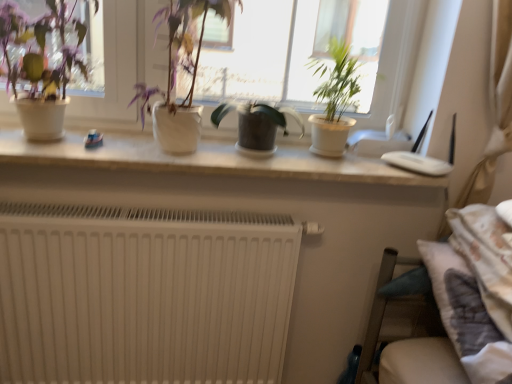
Describe the element at coordinates (256, 124) in the screenshot. I see `green matte plant at center, which is counted as the second houseplant, starting from the right` at that location.

This screenshot has width=512, height=384. I want to click on green matte plant at upper right, positioned as the first houseplant in right-to-left order, so click(x=334, y=100).

Image resolution: width=512 pixels, height=384 pixels. In order to click on matte white pot at upper left, the 1th houseplant from the left in this screenshot , I will do `click(41, 66)`.

The height and width of the screenshot is (384, 512). What do you see at coordinates (41, 66) in the screenshot?
I see `matte white pot at upper left, marked as the 4th houseplant in a right-to-left arrangement` at bounding box center [41, 66].

Locate an element on the screen. Image resolution: width=512 pixels, height=384 pixels. white matte radiator at lower left is located at coordinates (144, 294).

Which is correct: white matte radiator at lower left is inside matte white pot at center, which is counted as the 2th houseplant, starting from the left, or outside of it?

white matte radiator at lower left is outside matte white pot at center, which is counted as the 2th houseplant, starting from the left.

Between white matte radiator at lower left and matte white pot at center, which is counted as the 2th houseplant, starting from the left, which one has larger size?

white matte radiator at lower left.

Which houseplant is the 3rd one when counting from the front of the white matte radiator at lower left? Please provide its 2D coordinates.

[(176, 72)]

Looking at this image, from their relative heights in the image, would you say green matte plant at upper right, positioned as the first houseplant in right-to-left order, is taller or shorter than matte white pot at center, which is counted as the 2th houseplant, starting from the left?

green matte plant at upper right, positioned as the first houseplant in right-to-left order, is shorter than matte white pot at center, which is counted as the 2th houseplant, starting from the left.

Is green matte plant at upper right, positioned as the first houseplant in right-to-left order, bigger than matte white pot at center, which is the third houseplant from right to left?

No, green matte plant at upper right, positioned as the first houseplant in right-to-left order, is not bigger than matte white pot at center, which is the third houseplant from right to left.

Starting from the matte white pot at center, which is counted as the 2th houseplant, starting from the left, which houseplant is the 2nd one behind? Please provide its 2D coordinates.

[(334, 100)]

Identify the location of houseplant located on the left of matte white pot at center, which is counted as the 2th houseplant, starting from the left. (41, 66).

Considering the relative sizes of matte white pot at center, which is the third houseplant from right to left, and matte white pot at upper left, marked as the 4th houseplant in a right-to-left arrangement, in the image provided, is matte white pot at center, which is the third houseplant from right to left, taller than matte white pot at upper left, marked as the 4th houseplant in a right-to-left arrangement,?

Indeed, matte white pot at center, which is the third houseplant from right to left, has a greater height compared to matte white pot at upper left, marked as the 4th houseplant in a right-to-left arrangement.

Considering the relative sizes of matte white pot at center, which is counted as the 2th houseplant, starting from the left, and matte white pot at upper left, the 1th houseplant from the left, in the image provided, is matte white pot at center, which is counted as the 2th houseplant, starting from the left, smaller than matte white pot at upper left, the 1th houseplant from the left,?

Incorrect, matte white pot at center, which is counted as the 2th houseplant, starting from the left, is not smaller in size than matte white pot at upper left, the 1th houseplant from the left.

Can we say matte white pot at center, which is the third houseplant from right to left, lies outside white matte radiator at lower left?

Yes, matte white pot at center, which is the third houseplant from right to left, is located beyond the bounds of white matte radiator at lower left.

Which of these two, matte white pot at center, which is the third houseplant from right to left, or white matte radiator at lower left, is smaller?

With smaller size is matte white pot at center, which is the third houseplant from right to left.

Does matte white pot at center, which is the third houseplant from right to left, lie in front of white matte radiator at lower left?

Yes, it is in front of white matte radiator at lower left.

Is green matte plant at center, which is counted as the second houseplant, starting from the right, oriented towards matte white pot at upper left, the 1th houseplant from the left?

No, green matte plant at center, which is counted as the second houseplant, starting from the right, is not facing towards matte white pot at upper left, the 1th houseplant from the left.

Are green matte plant at center, the 3th houseplant viewed from the left, and matte white pot at upper left, the 1th houseplant from the left, beside each other?

No, green matte plant at center, the 3th houseplant viewed from the left, is not in contact with matte white pot at upper left, the 1th houseplant from the left.

Does green matte plant at center, which is counted as the second houseplant, starting from the right, come behind matte white pot at upper left, marked as the 4th houseplant in a right-to-left arrangement?

Yes, the depth of green matte plant at center, which is counted as the second houseplant, starting from the right, is greater than that of matte white pot at upper left, marked as the 4th houseplant in a right-to-left arrangement.

From the image's perspective, which houseplant is the 3rd one above the green matte plant at center, which is counted as the second houseplant, starting from the right? Please provide its 2D coordinates.

[(41, 66)]

Is point (338, 98) closer or farther from the camera than point (108, 305)?

Point (338, 98) appears to be farther away from the viewer than point (108, 305).

I want to click on radiator that is behind the green matte plant at upper right, positioned as the fourth houseplant in left-to-right order, so click(x=144, y=294).

From a real-world perspective, is green matte plant at upper right, positioned as the fourth houseplant in left-to-right order, physically above white matte radiator at lower left?

Yes, from a real-world perspective, green matte plant at upper right, positioned as the fourth houseplant in left-to-right order, is on top of white matte radiator at lower left.

Which object is positioned more to the left, green matte plant at upper right, positioned as the fourth houseplant in left-to-right order, or white matte radiator at lower left?

white matte radiator at lower left.

Find the location of `houseplant lying behind the white matte radiator at lower left`. houseplant lying behind the white matte radiator at lower left is located at coordinates (256, 124).

Based on the photo, from the image's perspective, is white matte radiator at lower left located above or below green matte plant at center, which is counted as the second houseplant, starting from the right?

white matte radiator at lower left is situated lower than green matte plant at center, which is counted as the second houseplant, starting from the right, in the image.

How many degrees apart are the facing directions of white matte radiator at lower left and green matte plant at center, the 3th houseplant viewed from the left?

The angle between the facing direction of white matte radiator at lower left and the facing direction of green matte plant at center, the 3th houseplant viewed from the left, is 1.74 degrees.

Considering the sizes of objects white matte radiator at lower left and green matte plant at center, which is counted as the second houseplant, starting from the right, in the image provided, who is shorter, white matte radiator at lower left or green matte plant at center, which is counted as the second houseplant, starting from the right,?

green matte plant at center, which is counted as the second houseplant, starting from the right.

Identify the location of houseplant that is the 1st object to the right of the white matte radiator at lower left, starting at the anchor. The height and width of the screenshot is (384, 512). (176, 72).

From a real-world perspective, which houseplant is the 2nd one underneath the matte white pot at center, which is the third houseplant from right to left? Please provide its 2D coordinates.

[(334, 100)]

Looking at this image, based on their spatial positions, is green matte plant at center, which is counted as the second houseplant, starting from the right, or matte white pot at center, which is the third houseplant from right to left, closer to green matte plant at upper right, positioned as the first houseplant in right-to-left order?

The object closer to green matte plant at upper right, positioned as the first houseplant in right-to-left order, is green matte plant at center, which is counted as the second houseplant, starting from the right.

Based on their spatial positions, is matte white pot at center, which is the third houseplant from right to left, or green matte plant at upper right, positioned as the first houseplant in right-to-left order, further from white matte radiator at lower left?

The object further to white matte radiator at lower left is green matte plant at upper right, positioned as the first houseplant in right-to-left order.

When comparing their distances from matte white pot at center, which is the third houseplant from right to left, does matte white pot at upper left, the 1th houseplant from the left, or green matte plant at upper right, positioned as the first houseplant in right-to-left order, seem further?

The object further to matte white pot at center, which is the third houseplant from right to left, is green matte plant at upper right, positioned as the first houseplant in right-to-left order.

Estimate the real-world distances between objects in this image. Which object is further from green matte plant at center, which is counted as the second houseplant, starting from the right, white matte radiator at lower left or green matte plant at upper right, positioned as the fourth houseplant in left-to-right order?

The object further to green matte plant at center, which is counted as the second houseplant, starting from the right, is white matte radiator at lower left.

Which object lies nearer to the anchor point white matte radiator at lower left, matte white pot at upper left, marked as the 4th houseplant in a right-to-left arrangement, or matte white pot at center, which is counted as the 2th houseplant, starting from the left?

Among the two, matte white pot at center, which is counted as the 2th houseplant, starting from the left, is located nearer to white matte radiator at lower left.

Estimate the real-world distances between objects in this image. Which object is further from green matte plant at center, which is counted as the second houseplant, starting from the right, matte white pot at upper left, marked as the 4th houseplant in a right-to-left arrangement, or green matte plant at upper right, positioned as the first houseplant in right-to-left order?

matte white pot at upper left, marked as the 4th houseplant in a right-to-left arrangement.

Considering their positions, is matte white pot at center, which is the third houseplant from right to left, positioned closer to green matte plant at center, the 3th houseplant viewed from the left, than matte white pot at upper left, the 1th houseplant from the left?

matte white pot at center, which is the third houseplant from right to left.

When comparing their distances from matte white pot at upper left, the 1th houseplant from the left, does green matte plant at upper right, positioned as the fourth houseplant in left-to-right order, or green matte plant at center, the 3th houseplant viewed from the left, seem closer?

green matte plant at center, the 3th houseplant viewed from the left.

I want to click on houseplant between green matte plant at upper right, positioned as the first houseplant in right-to-left order, and white matte radiator at lower left from top to bottom, so click(256, 124).

At what (x,y) coordinates should I click in order to perform the action: click on radiator between matte white pot at upper left, marked as the 4th houseplant in a right-to-left arrangement, and green matte plant at upper right, positioned as the fourth houseplant in left-to-right order, in the horizontal direction. Please return your answer as a coordinate pair (x, y). The width and height of the screenshot is (512, 384). Looking at the image, I should click on (144, 294).

Image resolution: width=512 pixels, height=384 pixels. Identify the location of houseplant between matte white pot at upper left, the 1th houseplant from the left, and green matte plant at center, which is counted as the second houseplant, starting from the right. pyautogui.click(x=176, y=72).

This screenshot has width=512, height=384. In order to click on houseplant located between matte white pot at center, which is the third houseplant from right to left, and green matte plant at upper right, positioned as the first houseplant in right-to-left order, in the left-right direction in this screenshot , I will do `click(256, 124)`.